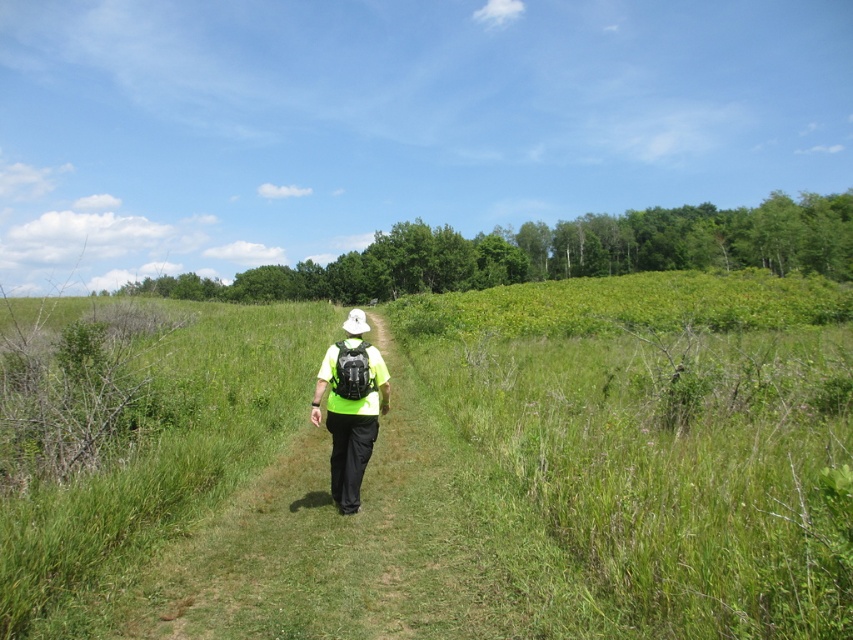
Question: Does green grassy at center come in front of matte black backpack at center?

Choices:
 (A) yes
 (B) no

Answer: (A)

Question: Is green grassy at center positioned before matte black backpack at center?

Choices:
 (A) no
 (B) yes

Answer: (B)

Question: Is green grassy at center above matte black backpack at center?

Choices:
 (A) no
 (B) yes

Answer: (B)

Question: Which object appears farthest from the camera in this image?

Choices:
 (A) green grassy at center
 (B) matte black backpack at center

Answer: (B)